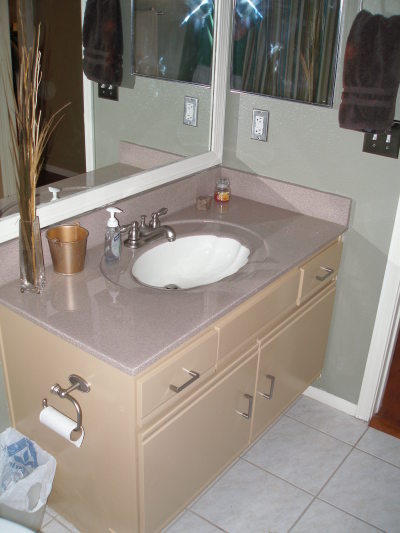
I want to click on decor, so click(30, 184).